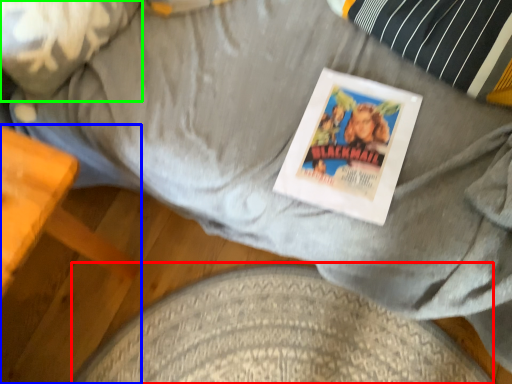
Question: Which object is positioned farthest from dog bed (highlighted by a red box)? Select from furniture (highlighted by a blue box) and pillow (highlighted by a green box).

Choices:
 (A) furniture
 (B) pillow

Answer: (B)